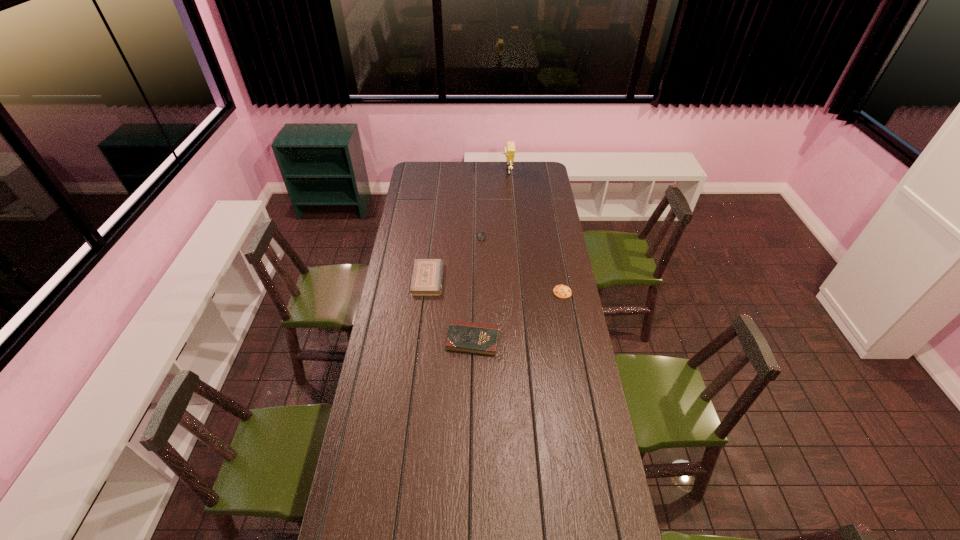
Locate an element on the screen. vacant area at the far edge of the desktop is located at coordinates (519, 179).

The height and width of the screenshot is (540, 960). Identify the location of vacant area at the left edge of the desktop. (395, 382).

Identify the location of vacant space at the right edge of the desktop. The height and width of the screenshot is (540, 960). (579, 429).

Find the location of `vacant area that lies between the computer mouse and the shortest object`. vacant area that lies between the computer mouse and the shortest object is located at coordinates (521, 265).

Where is `free area in between the right Bible and the cookie`? free area in between the right Bible and the cookie is located at coordinates (517, 316).

Find the location of a particular element. free space between the cookie and the farthest object is located at coordinates (535, 232).

Locate an element on the screen. empty space between the fourth object from left to right and the rightmost object is located at coordinates (535, 232).

Find the location of `vacant space that's between the leftmost object and the shortest object`. vacant space that's between the leftmost object and the shortest object is located at coordinates (495, 286).

This screenshot has height=540, width=960. I want to click on vacant space that is in between the farther Bible and the cookie, so click(x=495, y=286).

You are a GUI agent. You are given a task and a screenshot of the screen. Output one action in this format:
    pyautogui.click(x=<x>, y=<y>)
    Task: Click on the free spot between the fourth tallest object and the rightmost object
    The width and height of the screenshot is (960, 540).
    Given the screenshot: What is the action you would take?
    pyautogui.click(x=521, y=265)